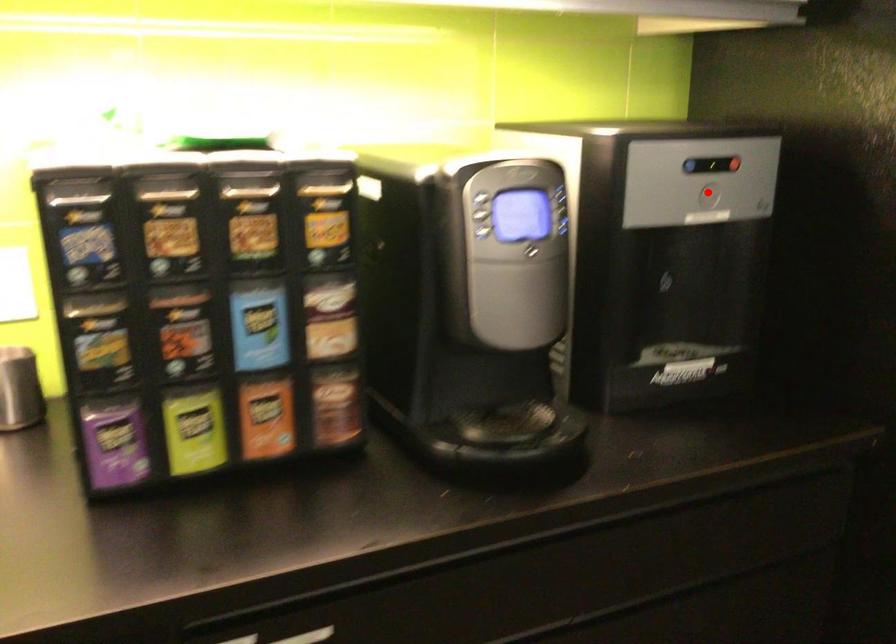
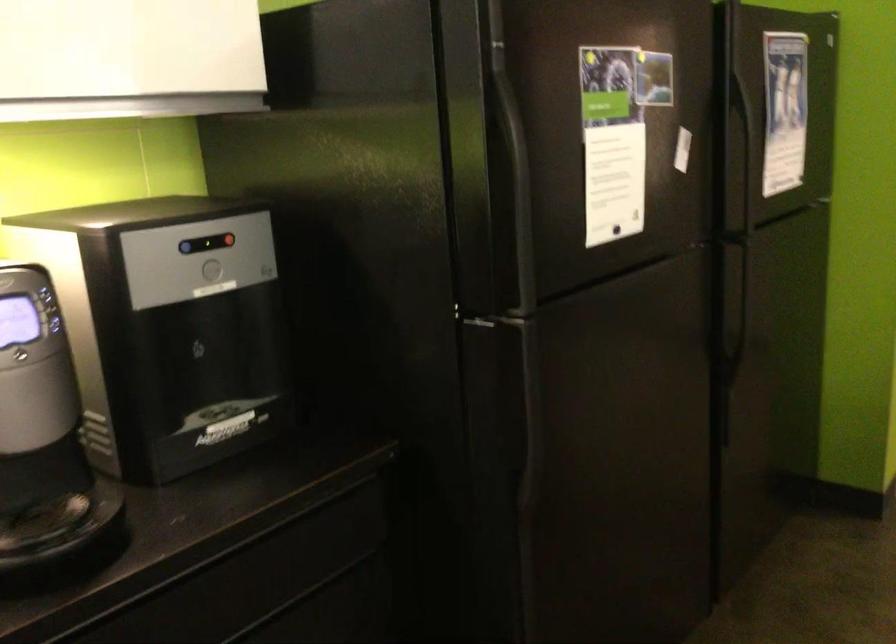
Question: I am providing you with two images of the same scene from different viewpoints. A red point is shown in image1. For the corresponding object point in image2, is it positioned nearer or farther from the camera?

Choices:
 (A) Nearer
 (B) Farther

Answer: (B)